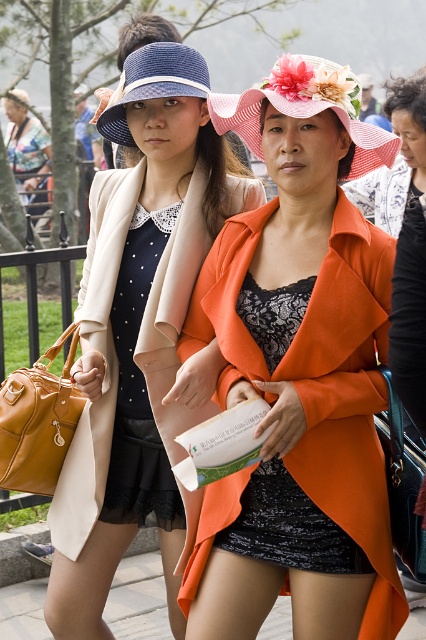
Is point (339, 349) farther from viewer compared to point (242, 97)?

No, (339, 349) is in front of (242, 97).

What do you see at coordinates (299, 374) in the screenshot? I see `orange matte coat at center` at bounding box center [299, 374].

Which is in front, point (209, 317) or point (322, 84)?

Point (322, 84) is more forward.

At what (x,y) coordinates should I click in order to perform the action: click on orange matte coat at center. Please return your answer as a coordinate pair (x, y). The image size is (426, 640). Looking at the image, I should click on (299, 374).

Between matte beige coat at center and pink straw hat at center, which one appears on the right side from the viewer's perspective?

From the viewer's perspective, pink straw hat at center appears more on the right side.

Can you confirm if matte beige coat at center is wider than pink straw hat at center?

Correct, the width of matte beige coat at center exceeds that of pink straw hat at center.

Between point (215, 342) and point (258, 122), which one is positioned behind?

The point (215, 342) is behind.

Identify the location of matte beige coat at center. (141, 337).

Who is taller, orange matte coat at center or matte black dress at upper left?

With more height is orange matte coat at center.

Locate an element on the screen. The image size is (426, 640). orange matte coat at center is located at coordinates (299, 374).

Does point (362, 134) come behind point (31, 170)?

No, it is not.

The width and height of the screenshot is (426, 640). I want to click on orange matte coat at center, so click(299, 374).